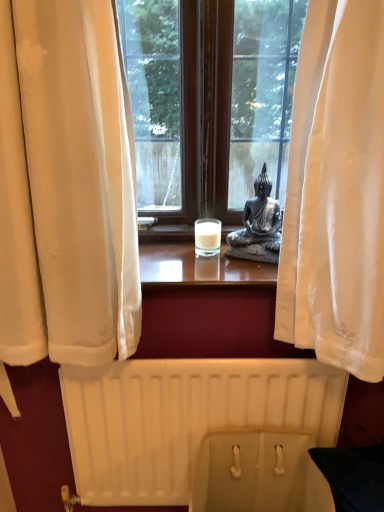
Question: Is beige fabric toilet bowl at lower center inside or outside of white matte radiator at lower center?

Choices:
 (A) inside
 (B) outside

Answer: (B)

Question: Looking at their shapes, would you say beige fabric toilet bowl at lower center is wider or thinner than white matte radiator at lower center?

Choices:
 (A) thin
 (B) wide

Answer: (B)

Question: Estimate the real-world distances between objects in this image. Which object is farther from the white matte radiator at lower center?

Choices:
 (A) white frosted glass candle at center
 (B) satin black statue at center
 (C) beige fabric toilet bowl at lower center

Answer: (A)

Question: Estimate the real-world distances between objects in this image. Which object is farther from the white matte radiator at lower center?

Choices:
 (A) satin black statue at center
 (B) beige fabric toilet bowl at lower center
 (C) white frosted glass candle at center

Answer: (C)